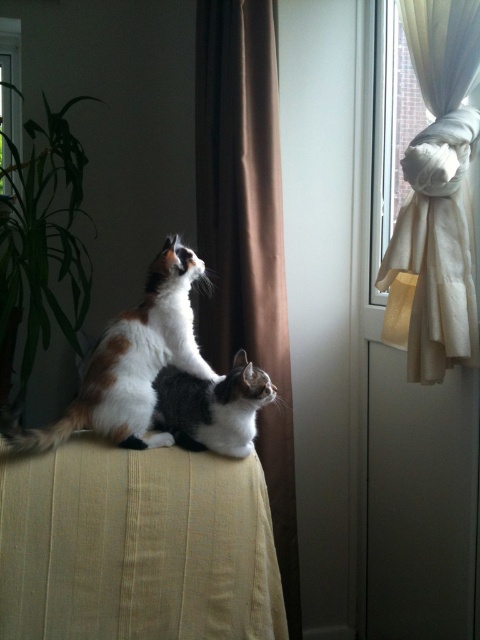
Is point (240, 253) in front of point (233, 445)?

No, it is not.

This screenshot has width=480, height=640. What are the coordinates of `brown fabric curtain at center` in the screenshot? It's located at (247, 236).

Can you confirm if calico fur cat at center is positioned above black-and-white fur cat at center?

Correct, calico fur cat at center is located above black-and-white fur cat at center.

You are a GUI agent. You are given a task and a screenshot of the screen. Output one action in this format:
    pyautogui.click(x=<x>, y=<y>)
    Task: Click on the calico fur cat at center
    The image size is (480, 640).
    Given the screenshot: What is the action you would take?
    pyautogui.click(x=131, y=362)

Does brown fabric curtain at center have a lesser width compared to calico fur cat at center?

Yes, brown fabric curtain at center is thinner than calico fur cat at center.

This screenshot has height=640, width=480. What are the coordinates of `brown fabric curtain at center` in the screenshot? It's located at (247, 236).

Locate an element on the screen. This screenshot has width=480, height=640. brown fabric curtain at center is located at coordinates (247, 236).